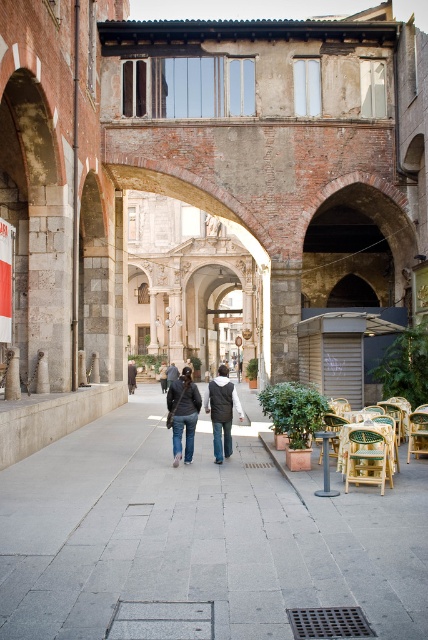
You are standing at the entrance of the pedestrian walkway and see the wooden chair at lower right. If you want to move towards the chair, which direction should you walk relative to the walkway?

The wooden chair at lower right is located at point [368,460], so you should walk towards the lower right direction along the walkway to reach it.

You are standing in the middle of the walkway and see two jackets hanging on a rack between the two buildings. Which jacket is closer to the red brick and stone building on the left? The denim jacket at center or the dark gray jacket at center?

The dark gray jacket at center is closer to the red brick and stone building on the left because the denim jacket at center is to the right of it.

You are standing at the pedestrian walkway in this historic city scene. There is a point marked at coordinates (199, 534). What surface is this point located on?

The point (199, 534) is located on the gray concrete pavement at center.